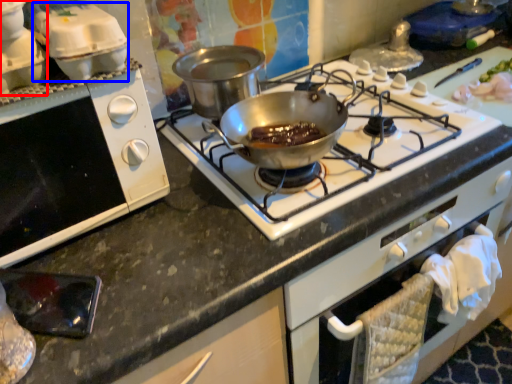
Question: Which object is further to the camera taking this photo, kitchen appliance (highlighted by a red box) or appliance (highlighted by a blue box)?

Choices:
 (A) kitchen appliance
 (B) appliance

Answer: (B)